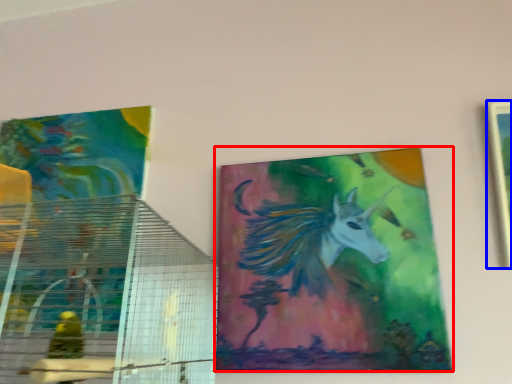
Question: Which object is further to the camera taking this photo, picture frame (highlighted by a red box) or picture frame (highlighted by a blue box)?

Choices:
 (A) picture frame
 (B) picture frame

Answer: (A)